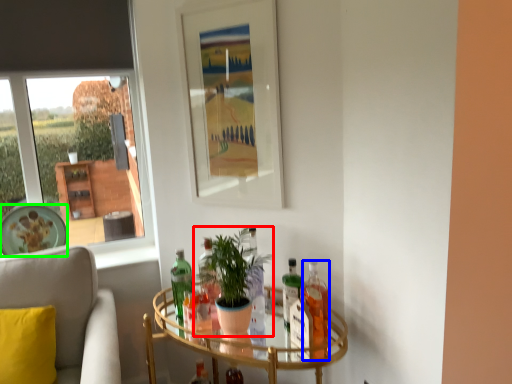
Question: Estimate the real-world distances between objects in this image. Which object is closer to houseplant (highlighted by a red box), bottle (highlighted by a blue box) or plate (highlighted by a green box)?

Choices:
 (A) bottle
 (B) plate

Answer: (A)